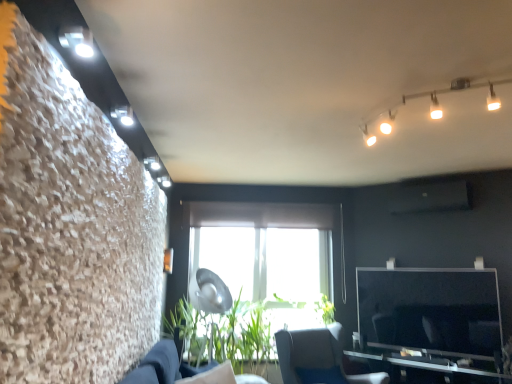
Where is `dark blue fabric couch at lower center`? dark blue fabric couch at lower center is located at coordinates (168, 368).

Image resolution: width=512 pixels, height=384 pixels. In order to click on metallic silver table at lower right in this screenshot , I will do `click(430, 365)`.

From the image's perspective, is dark blue fabric couch at lower center over blue fabric chair at center?

Yes.

From a real-world perspective, is dark blue fabric couch at lower center physically located above or below blue fabric chair at center?

From a real-world perspective, dark blue fabric couch at lower center is physically above blue fabric chair at center.

Is dark blue fabric couch at lower center bigger or smaller than blue fabric chair at center?

Clearly, dark blue fabric couch at lower center is smaller in size than blue fabric chair at center.

Is blue fabric chair at center with metallic silver table at lower right?

No, blue fabric chair at center is not in contact with metallic silver table at lower right.

Is point (323, 338) in front of point (438, 354)?

No, it is behind (438, 354).

Does blue fabric chair at center appear on the right side of metallic silver table at lower right?

No, blue fabric chair at center is not to the right of metallic silver table at lower right.

Based on the photo, is blue fabric chair at center turned away from metallic silver table at lower right?

No, metallic silver table at lower right is not at the back of blue fabric chair at center.

Between white glossy track lights at upper right and dark blue fabric couch at lower center, which one appears on the right side from the viewer's perspective?

From the viewer's perspective, white glossy track lights at upper right appears more on the right side.

Considering the relative sizes of white glossy track lights at upper right and dark blue fabric couch at lower center in the image provided, is white glossy track lights at upper right smaller than dark blue fabric couch at lower center?

Incorrect, white glossy track lights at upper right is not smaller in size than dark blue fabric couch at lower center.

Does white glossy track lights at upper right have a lesser height compared to dark blue fabric couch at lower center?

Yes.

From the picture: Measure the distance between white glossy track lights at upper right and dark blue fabric couch at lower center.

They are 2.22 meters apart.

From a real-world perspective, which is physically above, blue fabric chair at center or green leafy plant at center?

green leafy plant at center is physically above.

From the image's perspective, which is above, blue fabric chair at center or green leafy plant at center?

green leafy plant at center.

Does point (327, 379) come in front of point (278, 328)?

Yes, point (327, 379) is closer to viewer.

Where is `plant to the left of blue fabric chair at center`? Image resolution: width=512 pixels, height=384 pixels. plant to the left of blue fabric chair at center is located at coordinates (246, 334).

Looking at this image, from the image's perspective, between metallic silver table at lower right and blue fabric chair at center, who is located below?

From the image's view, metallic silver table at lower right is below.

Is metallic silver table at lower right to the left or to the right of blue fabric chair at center in the image?

Based on their positions, metallic silver table at lower right is located to the right of blue fabric chair at center.

From a real-world perspective, is metallic silver table at lower right physically above blue fabric chair at center?

No.

Is point (369, 345) positioned in front of point (316, 340)?

No.

Is metallic silver table at lower right facing towards white glossy track lights at upper right?

No, metallic silver table at lower right is not aimed at white glossy track lights at upper right.

Does metallic silver table at lower right lie behind white glossy track lights at upper right?

That is True.

Is metallic silver table at lower right located outside white glossy track lights at upper right?

Indeed, metallic silver table at lower right is completely outside white glossy track lights at upper right.

Is the depth of metallic silver table at lower right less than that of green leafy plant at center?

That is True.

Is metallic silver table at lower right in contact with green leafy plant at center?

metallic silver table at lower right and green leafy plant at center are not in contact.

From a real-world perspective, is metallic silver table at lower right positioned above or below green leafy plant at center?

In terms of real-world spatial position, metallic silver table at lower right is below green leafy plant at center.

Is green leafy plant at center inside metallic silver table at lower right?

No.

I want to click on couch above the blue fabric chair at center (from the image's perspective), so coord(168,368).

You are a GUI agent. You are given a task and a screenshot of the screen. Output one action in this format:
    pyautogui.click(x=<x>, y=<y>)
    Task: Click on the table behind the blue fabric chair at center
    The height and width of the screenshot is (384, 512).
    Given the screenshot: What is the action you would take?
    pyautogui.click(x=430, y=365)

Which object lies nearer to the anchor point white glossy track lights at upper right, blue fabric chair at center or green leafy plant at center?

The object closer to white glossy track lights at upper right is blue fabric chair at center.

Estimate the real-world distances between objects in this image. Which object is further from green leafy plant at center, dark blue fabric couch at lower center or metallic silver table at lower right?

metallic silver table at lower right.

From the image, which object appears to be nearer to blue fabric chair at center, metallic silver table at lower right or dark blue fabric couch at lower center?

Based on the image, metallic silver table at lower right appears to be nearer to blue fabric chair at center.

From the image, which object appears to be farther from dark blue fabric couch at lower center, blue fabric chair at center or metallic silver table at lower right?

metallic silver table at lower right is positioned further to the anchor dark blue fabric couch at lower center.

Which object lies nearer to the anchor point blue fabric chair at center, dark blue fabric couch at lower center or metallic silver table at lower right?

metallic silver table at lower right is positioned closer to the anchor blue fabric chair at center.

When comparing their distances from dark blue fabric couch at lower center, does metallic silver table at lower right or green leafy plant at center seem further?

metallic silver table at lower right is positioned further to the anchor dark blue fabric couch at lower center.

Looking at the image, which one is located closer to white glossy track lights at upper right, blue fabric chair at center or dark blue fabric couch at lower center?

dark blue fabric couch at lower center is closer to white glossy track lights at upper right.

Considering their positions, is dark blue fabric couch at lower center positioned closer to green leafy plant at center than blue fabric chair at center?

The object closer to green leafy plant at center is blue fabric chair at center.

Find the location of a particular element. Image resolution: width=512 pixels, height=384 pixels. furniture located between dark blue fabric couch at lower center and green leafy plant at center in the depth direction is located at coordinates (317, 358).

Locate an element on the screen. plant between white glossy track lights at upper right and metallic silver table at lower right vertically is located at coordinates (246, 334).

This screenshot has height=384, width=512. I want to click on couch between green leafy plant at center and metallic silver table at lower right from left to right, so click(x=168, y=368).

I want to click on furniture that lies between white glossy track lights at upper right and metallic silver table at lower right from top to bottom, so click(317, 358).